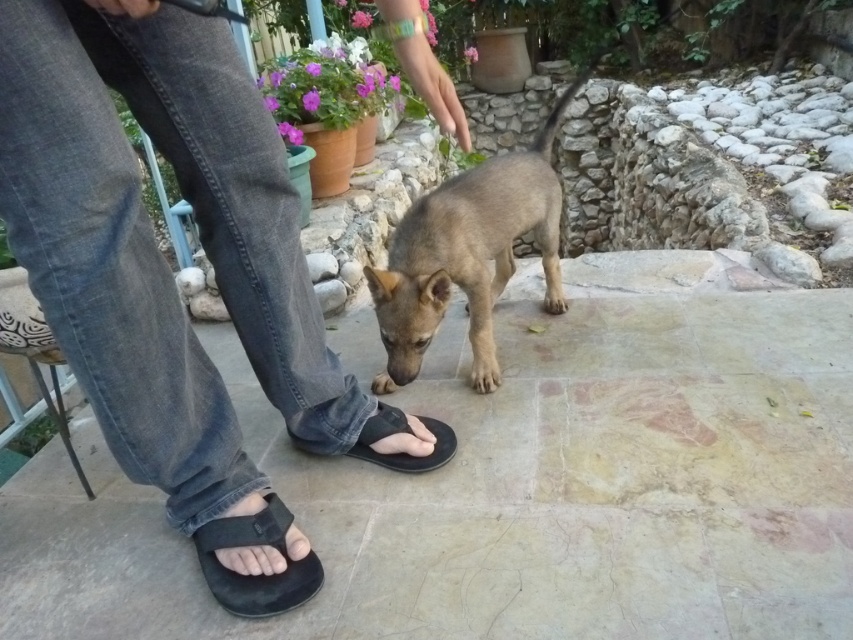
From the picture: Is denim jeans at lower left behind black fabric sandal at lower center?

That is False.

Does denim jeans at lower left have a greater height compared to black fabric sandal at lower center?

Indeed, denim jeans at lower left has a greater height compared to black fabric sandal at lower center.

Who is more forward, (41, 221) or (358, 456)?

Positioned in front is point (41, 221).

The image size is (853, 640). In order to click on denim jeans at lower left in this screenshot , I will do tap(169, 269).

Who is higher up, black fabric sandal at lower left or black fabric sandal at lower center?

black fabric sandal at lower center is above.

Describe the element at coordinates (256, 573) in the screenshot. The height and width of the screenshot is (640, 853). I see `black fabric sandal at lower left` at that location.

Identify the location of black fabric sandal at lower left. (256, 573).

This screenshot has width=853, height=640. What do you see at coordinates (469, 253) in the screenshot?
I see `fuzzy brown dog at center` at bounding box center [469, 253].

Does fuzzy brown dog at center have a greater width compared to black fabric sandal at lower center?

Indeed, fuzzy brown dog at center has a greater width compared to black fabric sandal at lower center.

Does point (556, 268) come in front of point (409, 429)?

No, it is not.

What are the coordinates of `fuzzy brown dog at center` in the screenshot? It's located at (469, 253).